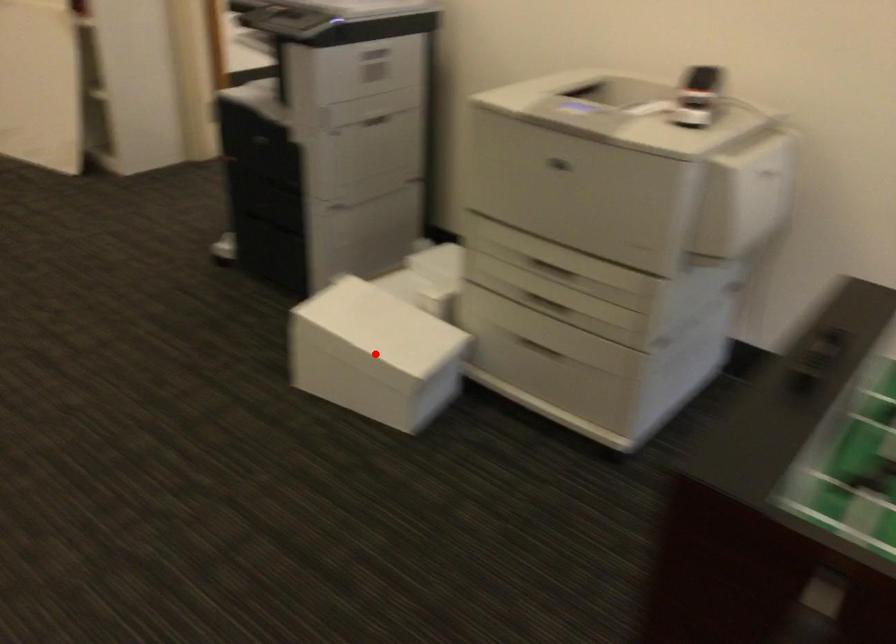
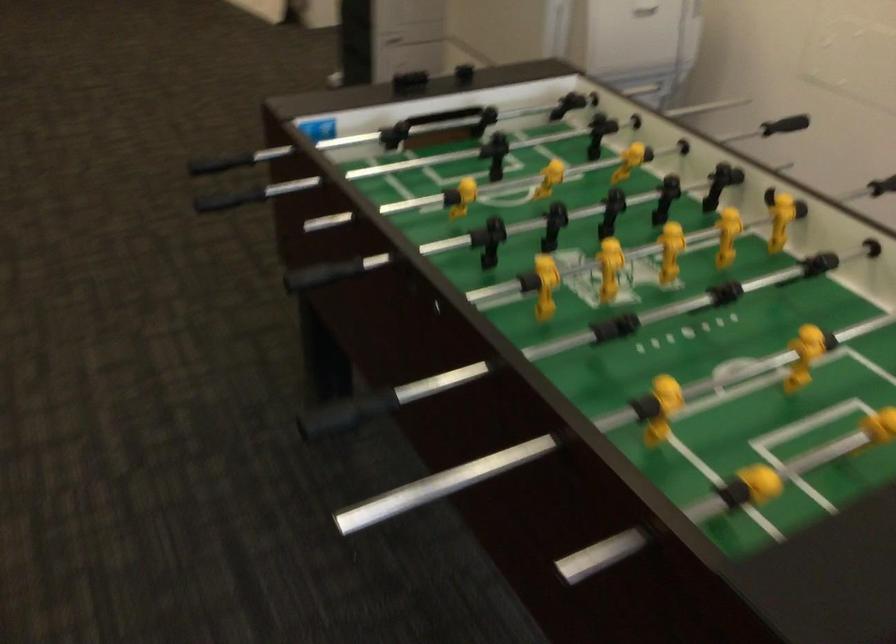
Question: I am providing you with two images of the same scene from different viewpoints. A red point is marked on the first image. Is the red point's position out of view in image 2?

Choices:
 (A) Yes
 (B) No

Answer: (A)